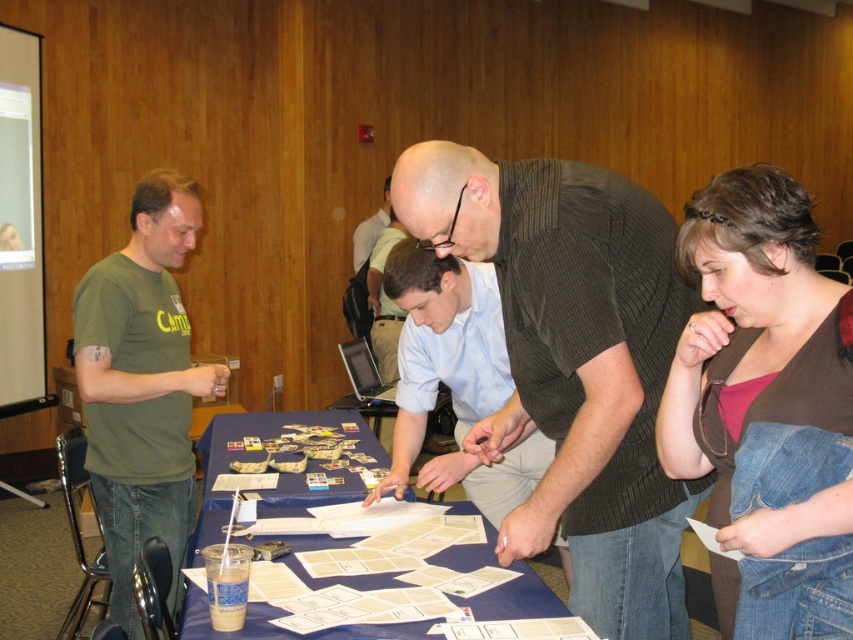
Can you confirm if green matte t-shirt at left is positioned to the right of blue paperboard at center?

In fact, green matte t-shirt at left is to the left of blue paperboard at center.

Is point (175, 465) positioned before point (254, 536)?

No, (175, 465) is behind (254, 536).

Where is `green matte t-shirt at left`? green matte t-shirt at left is located at coordinates (141, 385).

I want to click on green matte t-shirt at left, so click(141, 385).

Is green matte t-shirt at left below light blue shirt at center?

No.

This screenshot has height=640, width=853. Describe the element at coordinates (141, 385) in the screenshot. I see `green matte t-shirt at left` at that location.

At what (x,y) coordinates should I click in order to perform the action: click on green matte t-shirt at left. Please return your answer as a coordinate pair (x, y). Looking at the image, I should click on (141, 385).

Does brown denim jacket at lower right appear on the right side of green matte t-shirt at left?

Yes, brown denim jacket at lower right is to the right of green matte t-shirt at left.

Locate an element on the screen. The image size is (853, 640). brown denim jacket at lower right is located at coordinates [x=767, y=404].